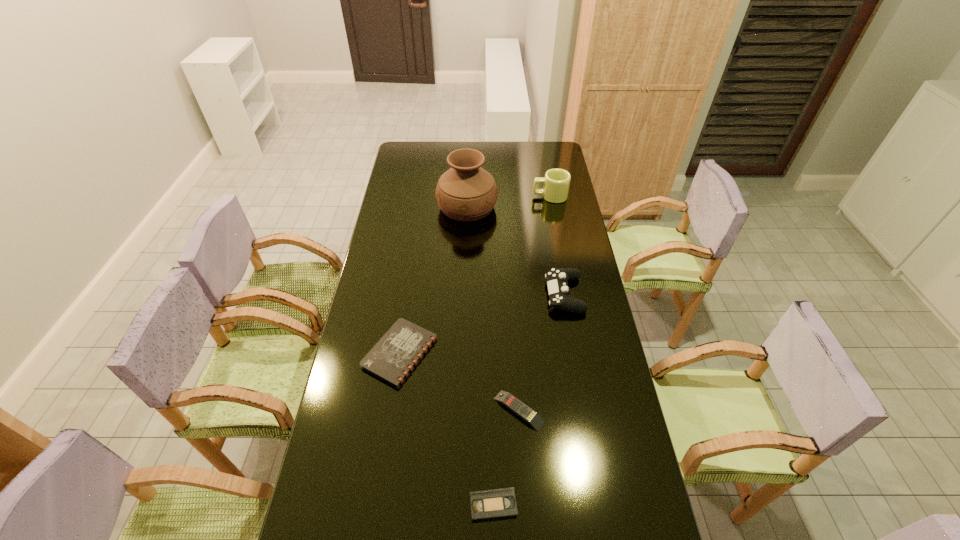
Locate an element on the screen. The image size is (960, 540). control positioned at the right edge is located at coordinates (557, 278).

What are the coordinates of `vacant space at the far edge of the desktop` in the screenshot? It's located at (435, 160).

Identify the location of vacant space at the left edge. (387, 240).

I want to click on blank area at the right edge, so click(545, 238).

Find the location of a particular element. This screenshot has width=960, height=540. vacant area at the far right corner is located at coordinates (565, 163).

Where is `free point between the remote control and the control`? free point between the remote control and the control is located at coordinates (541, 352).

Find the location of a particular element. The height and width of the screenshot is (540, 960). vacant space in between the fourth shortest object and the fourth farthest object is located at coordinates (482, 323).

The image size is (960, 540). I want to click on vacant space that's between the videotape and the mug, so click(521, 350).

Image resolution: width=960 pixels, height=540 pixels. What are the coordinates of `vacant region between the remote control and the urn` in the screenshot? It's located at (493, 309).

Identify the location of unoccupied area between the fifth shortest object and the nearest object. (521, 350).